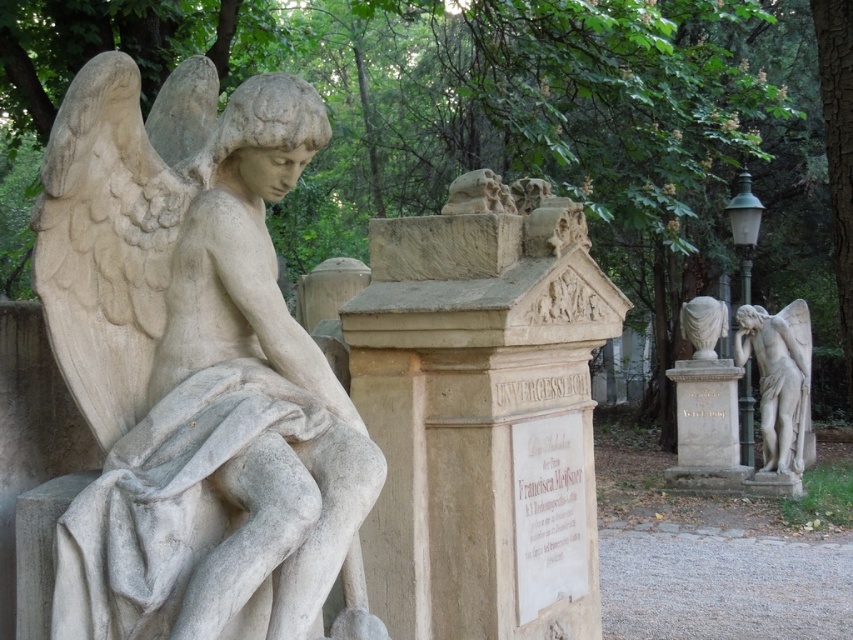
You are a tour guide explaining the layout of this memorial garden. You mention the beige stone monument at center and the matte stone angel at right. Which object is wider?

The matte stone angel at right is wider than the beige stone monument at center.

You are standing at the entrance of the cemetery and want to locate two specific points marked in the image. The first point is at coordinates point (474, 589), and the second is at point (790, 422). Which of these two points is closer to you as you face the scene?

Point (474, 589) is in front of point (790, 422), so it is closer to you as you face the scene.